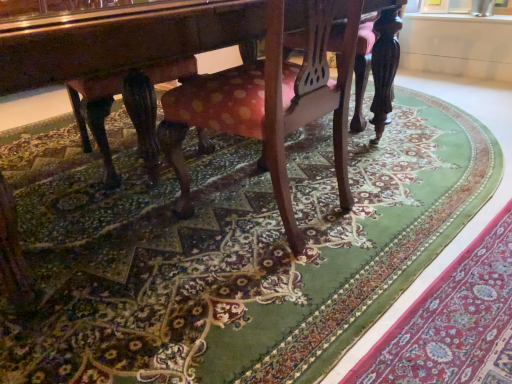
Identify the location of polka dot fabric chair at center. pyautogui.click(x=271, y=104).

What do you see at coordinates (271, 104) in the screenshot? The width and height of the screenshot is (512, 384). I see `polka dot fabric chair at center` at bounding box center [271, 104].

Measure the distance between polka dot fabric chair at center and camera.

3.29 feet.

This screenshot has width=512, height=384. Describe the element at coordinates (453, 322) in the screenshot. I see `green carpet at lower right` at that location.

Image resolution: width=512 pixels, height=384 pixels. I want to click on green carpet at lower right, so click(x=453, y=322).

This screenshot has width=512, height=384. I want to click on polka dot fabric chair at center, so click(271, 104).

Between polka dot fabric chair at center and green carpet at lower right, which one appears on the left side from the viewer's perspective?

Positioned to the left is polka dot fabric chair at center.

Which is in front, polka dot fabric chair at center or green carpet at lower right?

green carpet at lower right is in front.

Considering the positions of point (217, 92) and point (507, 247), is point (217, 92) closer or farther from the camera than point (507, 247)?

Point (217, 92) is closer to the camera than point (507, 247).

From the image's perspective, which is above, polka dot fabric chair at center or green carpet at lower right?

From the image's view, polka dot fabric chair at center is above.

From a real-world perspective, between polka dot fabric chair at center and green carpet at lower right, who is vertically lower?

green carpet at lower right.

From the picture: Between polka dot fabric chair at center and green carpet at lower right, which one has smaller width?

green carpet at lower right.

Is polka dot fabric chair at center shorter than green carpet at lower right?

In fact, polka dot fabric chair at center may be taller than green carpet at lower right.

Is polka dot fabric chair at center bigger than green carpet at lower right?

Correct, polka dot fabric chair at center is larger in size than green carpet at lower right.

Does polka dot fabric chair at center contain green carpet at lower right?

No.

Are polka dot fabric chair at center and green carpet at lower right located far from each other?

No, polka dot fabric chair at center is in close proximity to green carpet at lower right.

Does polka dot fabric chair at center turn towards green carpet at lower right?

No, polka dot fabric chair at center is not aimed at green carpet at lower right.

How many degrees apart are the facing directions of polka dot fabric chair at center and green carpet at lower right?

The facing directions of polka dot fabric chair at center and green carpet at lower right are 3.91 degrees apart.

Measure the distance from polka dot fabric chair at center to green carpet at lower right.

→ They are 25.16 inches apart.

You are a GUI agent. You are given a task and a screenshot of the screen. Output one action in this format:
    pyautogui.click(x=<x>, y=<y>)
    Task: Click on the chair located on the left of green carpet at lower right
    This screenshot has height=384, width=512.
    Given the screenshot: What is the action you would take?
    pyautogui.click(x=271, y=104)

Which is more to the left, green carpet at lower right or polka dot fabric chair at center?

polka dot fabric chair at center is more to the left.

Which object is closer to the camera, green carpet at lower right or polka dot fabric chair at center?

green carpet at lower right is more forward.

Which is in front, point (417, 374) or point (338, 127)?

The point (417, 374) is in front.

From the image's perspective, is green carpet at lower right below polka dot fabric chair at center?

Correct, green carpet at lower right appears lower than polka dot fabric chair at center in the image.

From the picture: From a real-world perspective, is green carpet at lower right physically below polka dot fabric chair at center?

Yes, from a real-world perspective, green carpet at lower right is beneath polka dot fabric chair at center.

Does green carpet at lower right have a lesser width compared to polka dot fabric chair at center?

Indeed, green carpet at lower right has a lesser width compared to polka dot fabric chair at center.

In terms of height, does green carpet at lower right look taller or shorter compared to polka dot fabric chair at center?

Considering their sizes, green carpet at lower right has less height than polka dot fabric chair at center.

From the picture: Who is bigger, green carpet at lower right or polka dot fabric chair at center?

Bigger between the two is polka dot fabric chair at center.

Would you say green carpet at lower right is inside or outside polka dot fabric chair at center?

green carpet at lower right is outside polka dot fabric chair at center.

Is green carpet at lower right far away from polka dot fabric chair at center?

Actually, green carpet at lower right and polka dot fabric chair at center are a little close together.

Looking at this image, is green carpet at lower right facing towards polka dot fabric chair at center?

No, green carpet at lower right is not oriented towards polka dot fabric chair at center.

How different are the orientations of green carpet at lower right and polka dot fabric chair at center in degrees?

3.91 degrees.

How distant is green carpet at lower right from polka dot fabric chair at center?

green carpet at lower right is 25.16 inches from polka dot fabric chair at center.

You are a GUI agent. You are given a task and a screenshot of the screen. Output one action in this format:
    pyautogui.click(x=<x>, y=<y>)
    Task: Click on the mat lying in front of the polka dot fabric chair at center
    
    Given the screenshot: What is the action you would take?
    pyautogui.click(x=453, y=322)

In order to click on mat on the right of polka dot fabric chair at center in this screenshot , I will do `click(453, 322)`.

Identify the location of chair positioned vertically above the green carpet at lower right (from a real-world perspective). (271, 104).